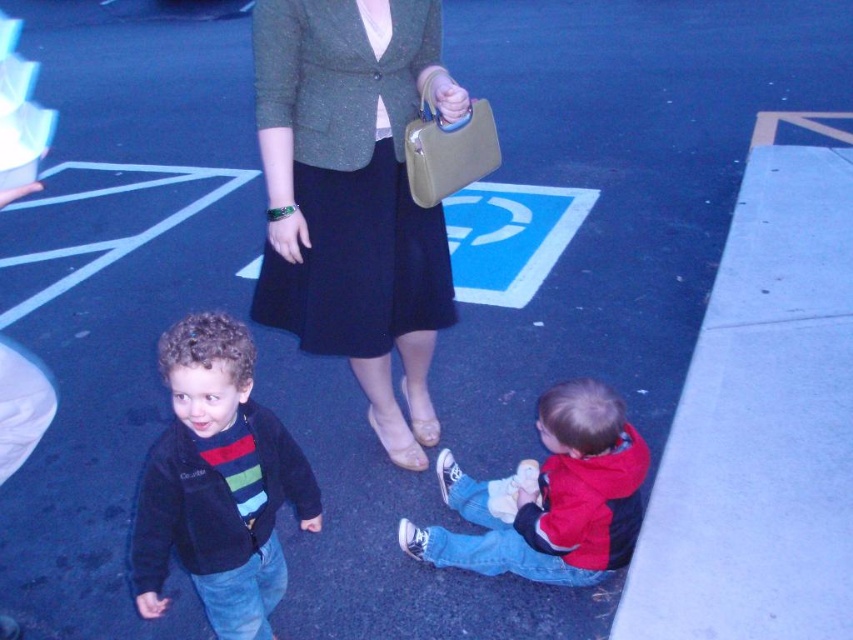
You are trying to locate the dark blue fleece jacket at center in the parking lot scene. Based on the coordinates provided, is it closer to the left or right side of the image?

The dark blue fleece jacket at center is located at point 0.756 on the x and y axis, which places it closer to the right side of the image.

You are a fashion designer observing two jackets in a photo. The jackets are the green textured blazer at center and the dark blue fleece jacket at center. Which jacket is positioned higher in the image?

The green textured blazer at center is positioned higher than the dark blue fleece jacket at center in the image.